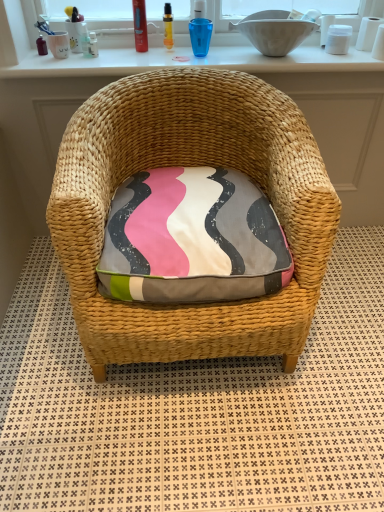
Find the location of a particular element. This screenshot has height=512, width=384. vacant space in front of shiny red can at upper center, marked as the 2th toiletry in a right-to-left arrangement is located at coordinates [x=134, y=60].